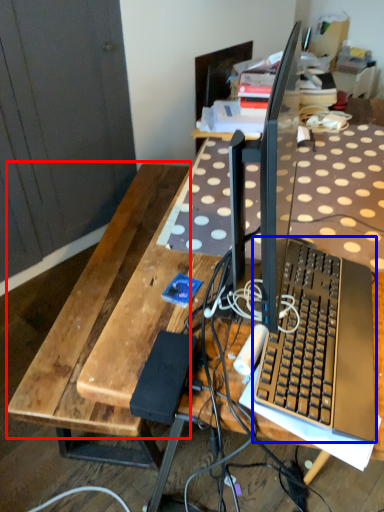
Question: Which of the following is the closest to the observer, wood (highlighted by a red box) or computer keyboard (highlighted by a blue box)?

Choices:
 (A) wood
 (B) computer keyboard

Answer: (B)